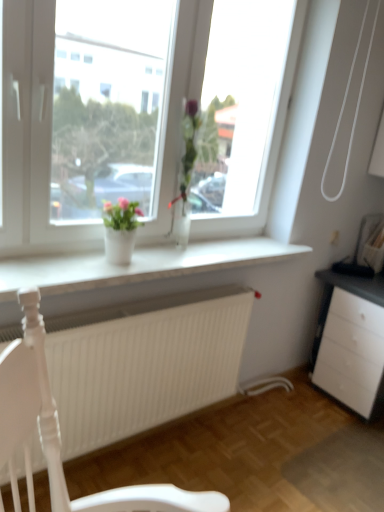
Identify the location of white glass vase at center. (32, 137).

In order to face white glass vase at center, should I rotate leftwards or rightwards?

To align with it, rotate left about 1.944°.

What do you see at coordinates (143, 362) in the screenshot? The image size is (384, 512). I see `white matte radiator at lower center` at bounding box center [143, 362].

Measure the distance between white smooth window sill at center and camera.

white smooth window sill at center is 1.33 meters from camera.

The height and width of the screenshot is (512, 384). I want to click on white smooth window sill at center, so click(x=137, y=265).

Find the location of a particular element. white glass vase at center is located at coordinates (32, 137).

Does clear glass vase at center, which is the 2th houseplant from left to right, turn towards white smooth window sill at center?

No, clear glass vase at center, which is the 2th houseplant from left to right, is not oriented towards white smooth window sill at center.

From the image's perspective, which one is positioned lower, clear glass vase at center, which is the first houseplant from right to left, or white smooth window sill at center?

white smooth window sill at center appears lower in the image.

You are a GUI agent. You are given a task and a screenshot of the screen. Output one action in this format:
    pyautogui.click(x=<x>, y=<y>)
    Task: Click on the window sill that is in front of the clear glass vase at center, which is the first houseplant from right to left
    The width and height of the screenshot is (384, 512).
    Given the screenshot: What is the action you would take?
    pyautogui.click(x=137, y=265)

How far apart are clear glass vase at center, which is the first houseplant from right to left, and white smooth window sill at center?

clear glass vase at center, which is the first houseplant from right to left, and white smooth window sill at center are 17.31 inches apart from each other.

From a real-world perspective, is white matte radiator at lower center physically above white glossy vase at center, the 2th houseplant from the right?

No.

Does white matte radiator at lower center appear on the right side of white glossy vase at center, the 1th houseplant from the left?

Yes, white matte radiator at lower center is to the right of white glossy vase at center, the 1th houseplant from the left.

Based on the photo, which is correct: white matte radiator at lower center is inside white glossy vase at center, the 1th houseplant from the left, or outside of it?

white matte radiator at lower center is spatially situated outside white glossy vase at center, the 1th houseplant from the left.

Identify the location of carpets located on the right of white glossy vase at center, the 1th houseplant from the left. This screenshot has height=512, width=384. (143, 362).

Considering the sizes of objects white glossy vase at center, the 2th houseplant from the right, and clear glass vase at center, which is the 2th houseplant from left to right, in the image provided, who is taller, white glossy vase at center, the 2th houseplant from the right, or clear glass vase at center, which is the 2th houseplant from left to right,?

clear glass vase at center, which is the 2th houseplant from left to right.

In the image, there is a clear glass vase at center, which is the 2th houseplant from left to right. In order to click on houseplant below it (from a real-world perspective) in this screenshot , I will do `click(120, 229)`.

From a real-world perspective, is white glossy vase at center, the 1th houseplant from the left, located beneath clear glass vase at center, which is the first houseplant from right to left?

Yes, from a real-world perspective, white glossy vase at center, the 1th houseplant from the left, is below clear glass vase at center, which is the first houseplant from right to left.

Does white glossy vase at center, the 1th houseplant from the left, have a smaller size compared to clear glass vase at center, which is the 2th houseplant from left to right?

Yes, white glossy vase at center, the 1th houseplant from the left, is smaller than clear glass vase at center, which is the 2th houseplant from left to right.

Do you think clear glass vase at center, which is the first houseplant from right to left, is within white matte radiator at lower center, or outside of it?

clear glass vase at center, which is the first houseplant from right to left, is not enclosed by white matte radiator at lower center.

From the image's perspective, count 2nd houseplants upward from the white matte radiator at lower center and point to it. Please provide its 2D coordinates.

[(193, 160)]

From the image's perspective, would you say clear glass vase at center, which is the 2th houseplant from left to right, is positioned over white matte radiator at lower center?

Yes, from the image's perspective, clear glass vase at center, which is the 2th houseplant from left to right, is over white matte radiator at lower center.

Which object is further away from the camera, clear glass vase at center, which is the first houseplant from right to left, or white matte radiator at lower center?

clear glass vase at center, which is the first houseplant from right to left, is behind.

Between white matte radiator at lower center and white glass vase at center, which one has more height?

Standing taller between the two is white glass vase at center.

Is point (205, 339) positioned behind point (36, 253)?

Yes.

Locate an element on the screen. window above the white matte radiator at lower center (from a real-world perspective) is located at coordinates (32, 137).

Consider the image. Which is closer, (x=283, y=115) or (x=228, y=354)?

Point (x=283, y=115) is farther from the camera than point (x=228, y=354).

Is white glass vase at center surrounding white matte radiator at lower center?

No, white matte radiator at lower center is located outside of white glass vase at center.

How different are the orientations of white glass vase at center and white matte radiator at lower center in degrees?

The facing directions of white glass vase at center and white matte radiator at lower center are 2.68 degrees apart.

Consider the image. Which object is positioned more to the left, white glass vase at center or white matte radiator at lower center?

white matte radiator at lower center.

Considering the sizes of white smooth window sill at center and white glossy vase at center, the 1th houseplant from the left, in the image, is white smooth window sill at center taller or shorter than white glossy vase at center, the 1th houseplant from the left,?

Clearly, white smooth window sill at center is shorter compared to white glossy vase at center, the 1th houseplant from the left.

Is point (243, 238) behind point (116, 233)?

Yes, point (243, 238) is farther from viewer.

Is the depth of white smooth window sill at center greater than that of white glossy vase at center, the 1th houseplant from the left?

That is False.

From the white smooth window sill at center, count 2nd houseplants backward and point to it. Please provide its 2D coordinates.

[(193, 160)]

From a real-world perspective, count 1st houseplants upward from the white matte radiator at lower center and point to it. Please provide its 2D coordinates.

[(120, 229)]

Estimate the real-world distances between objects in this image. Which object is closer to clear glass vase at center, which is the 2th houseplant from left to right, white glossy vase at center, the 1th houseplant from the left, or white matte radiator at lower center?

white glossy vase at center, the 1th houseplant from the left, is closer to clear glass vase at center, which is the 2th houseplant from left to right.

Which object lies further to the anchor point white smooth window sill at center, clear glass vase at center, which is the 2th houseplant from left to right, or white glass vase at center?

Based on the image, clear glass vase at center, which is the 2th houseplant from left to right, appears to be further to white smooth window sill at center.

Considering their positions, is white glass vase at center positioned further to white matte radiator at lower center than white smooth window sill at center?

Among the two, white glass vase at center is located further to white matte radiator at lower center.

In the scene shown: Which object lies nearer to the anchor point white glass vase at center, white glossy vase at center, the 1th houseplant from the left, or white matte radiator at lower center?

Among the two, white glossy vase at center, the 1th houseplant from the left, is located nearer to white glass vase at center.

From the image, which object appears to be nearer to white smooth window sill at center, white glossy vase at center, the 1th houseplant from the left, or clear glass vase at center, which is the first houseplant from right to left?

white glossy vase at center, the 1th houseplant from the left.

Based on their spatial positions, is white smooth window sill at center or clear glass vase at center, which is the first houseplant from right to left, closer to white glass vase at center?

white smooth window sill at center is positioned closer to the anchor white glass vase at center.

Estimate the real-world distances between objects in this image. Which object is closer to clear glass vase at center, which is the first houseplant from right to left, white smooth window sill at center or white glossy vase at center, the 1th houseplant from the left?

Among the two, white glossy vase at center, the 1th houseplant from the left, is located nearer to clear glass vase at center, which is the first houseplant from right to left.

Considering their positions, is white smooth window sill at center positioned closer to white glass vase at center than white matte radiator at lower center?

white smooth window sill at center is positioned closer to the anchor white glass vase at center.

Identify the location of houseplant between clear glass vase at center, which is the first houseplant from right to left, and white smooth window sill at center vertically. The image size is (384, 512). (120, 229).

You are a GUI agent. You are given a task and a screenshot of the screen. Output one action in this format:
    pyautogui.click(x=<x>, y=<y>)
    Task: Click on the window sill between white glass vase at center and white matte radiator at lower center from top to bottom
    The width and height of the screenshot is (384, 512).
    Given the screenshot: What is the action you would take?
    pyautogui.click(x=137, y=265)

Find the location of a particular element. houseplant positioned between white glass vase at center and clear glass vase at center, which is the 2th houseplant from left to right, from near to far is located at coordinates (120, 229).

This screenshot has height=512, width=384. What are the coordinates of `window sill between white glossy vase at center, the 2th houseplant from the right, and white matte radiator at lower center in the up-down direction` in the screenshot? It's located at (137, 265).